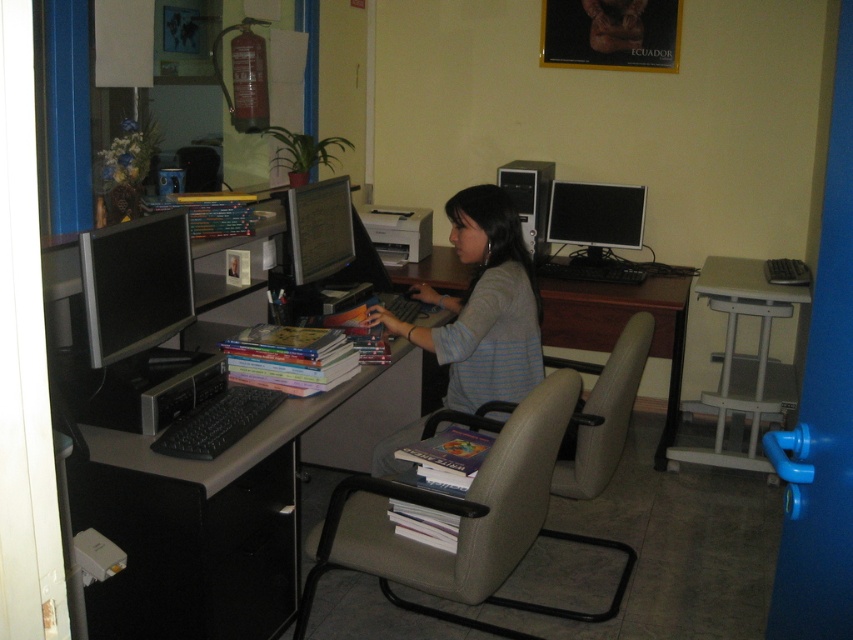
Between point (381, 518) and point (560, 195), which one is positioned in front?

Point (381, 518) is more forward.

Between point (422, 577) and point (589, 227), which one is positioned behind?

The point (589, 227) is more distant.

Where is `gray leather swivel chair at center`? The image size is (853, 640). gray leather swivel chair at center is located at coordinates (453, 513).

Is gray striped shirt at center below black glossy monitor at upper right?

Yes.

Does point (415, 298) come behind point (554, 240)?

No, it is not.

Is point (433, 300) in front of point (590, 248)?

Yes, point (433, 300) is in front of point (590, 248).

Locate an element on the screen. gray striped shirt at center is located at coordinates (482, 307).

Does gray leather swivel chair at center appear on the right side of matte black monitor at center?

Correct, you'll find gray leather swivel chair at center to the right of matte black monitor at center.

Does point (305, 582) come farther from viewer compared to point (322, 232)?

That is False.

Find the location of a particular element. The image size is (853, 640). gray leather swivel chair at center is located at coordinates (453, 513).